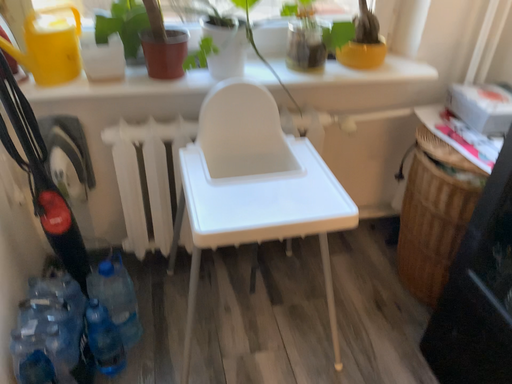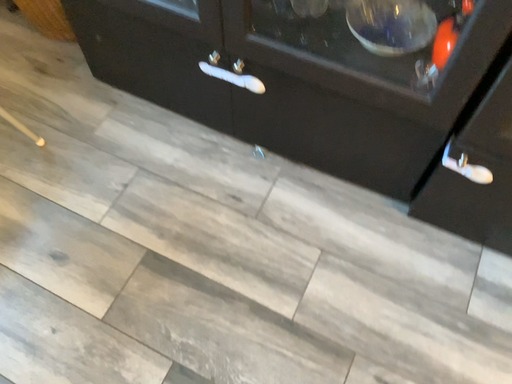
Question: How did the camera likely rotate when shooting the video?

Choices:
 (A) rotated left
 (B) rotated right

Answer: (B)